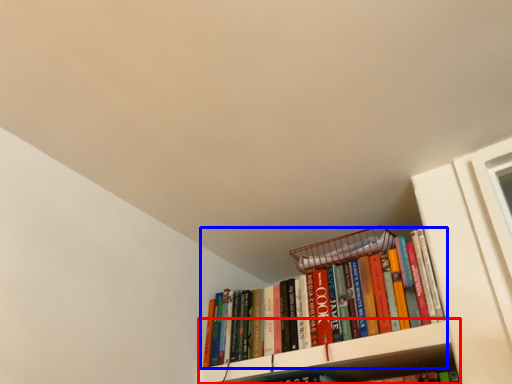
Question: Which object appears closest to the camera in this image, cabinet (highlighted by a red box) or book (highlighted by a blue box)?

Choices:
 (A) cabinet
 (B) book

Answer: (A)